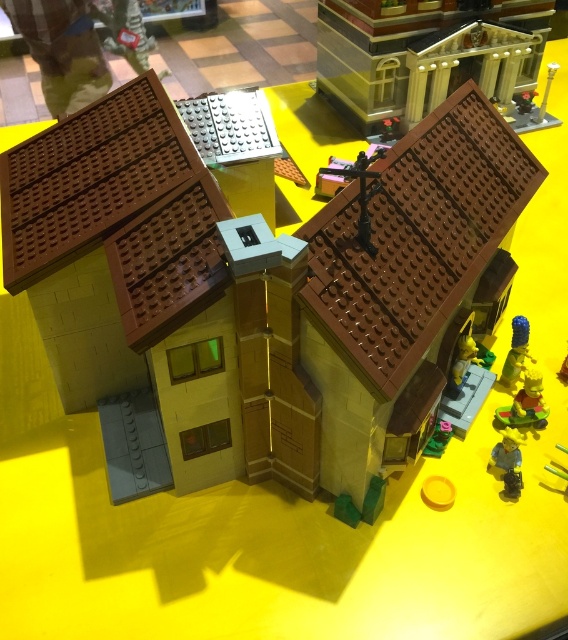
Is brick-patterned building at upper center behind blue rubber toy at upper right?

Yes, brick-patterned building at upper center is further from the viewer.

The width and height of the screenshot is (568, 640). What do you see at coordinates (423, 52) in the screenshot?
I see `brick-patterned building at upper center` at bounding box center [423, 52].

I want to click on brick-patterned building at upper center, so click(423, 52).

Can you confirm if brick-patterned building at upper center is positioned below yellow rubber duck at lower right?

No, brick-patterned building at upper center is not below yellow rubber duck at lower right.

Is brick-patterned building at upper center behind yellow rubber duck at lower right?

That is True.

Image resolution: width=568 pixels, height=640 pixels. Identify the location of brick-patterned building at upper center. (423, 52).

Image resolution: width=568 pixels, height=640 pixels. I want to click on brick-patterned building at upper center, so click(x=423, y=52).

Can you confirm if yellow rubber duck at lower right is wider than green plastic plant at lower right?

Yes.

Does point (538, 424) come closer to viewer compared to point (444, 436)?

No, it is behind (444, 436).

At what (x,y) coordinates should I click in order to perform the action: click on yellow rubber duck at lower right. Please return your answer as a coordinate pair (x, y). Looking at the image, I should click on (x=525, y=404).